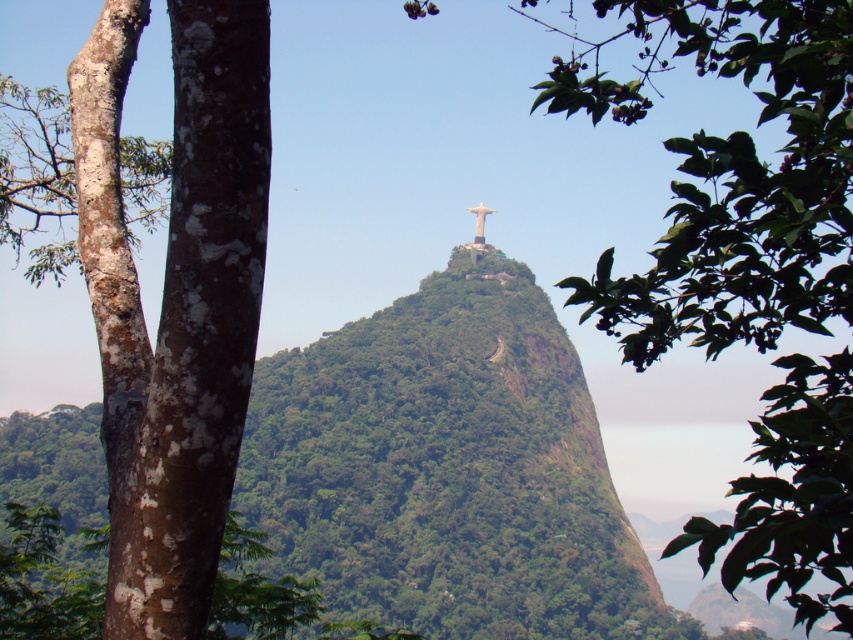
Looking at this image, does green leafy tree at upper center have a larger size compared to brown/scaly bark tree at left?

Correct, green leafy tree at upper center is larger in size than brown/scaly bark tree at left.

Does point (817, 20) come closer to viewer compared to point (103, 172)?

Yes, it is.

Is point (831, 403) positioned after point (165, 596)?

Yes.

The width and height of the screenshot is (853, 640). I want to click on green leafy tree at upper center, so click(732, 179).